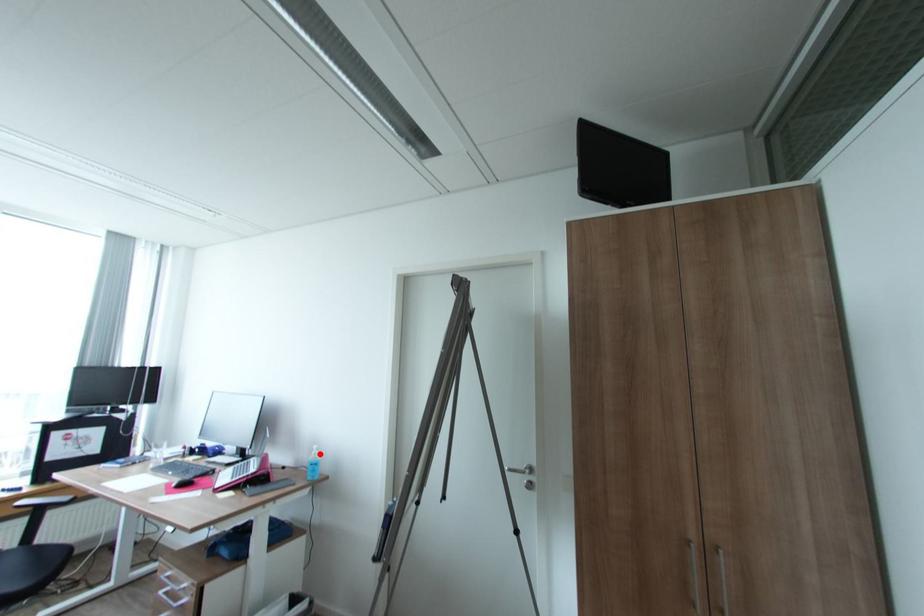
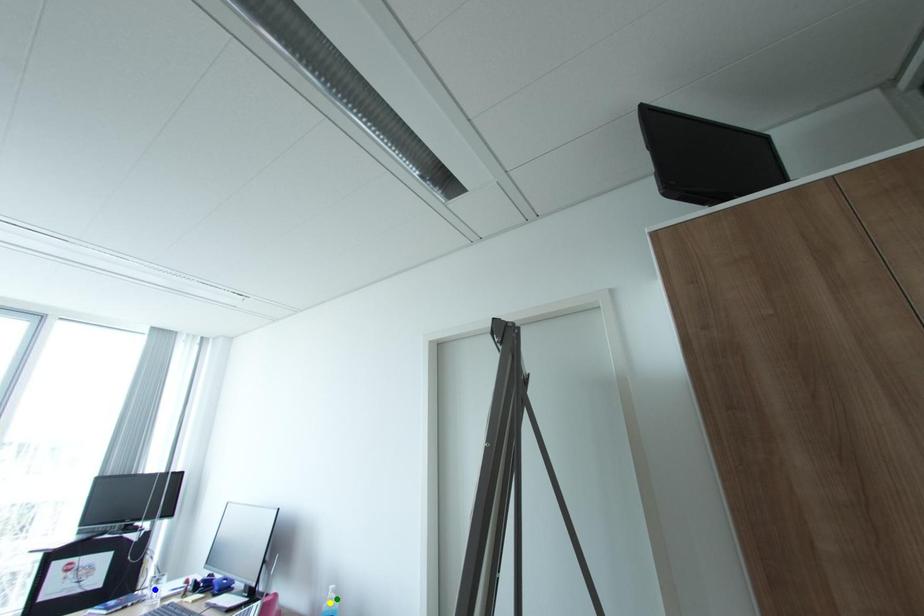
Question: I am providing you with two images of the same scene from different viewpoints. A red point is marked on the first image. You are given multiple points on the second image. Which mark in image 2 goes with the point in image 1?

Choices:
 (A) yellow point
 (B) blue point
 (C) green point

Answer: (C)